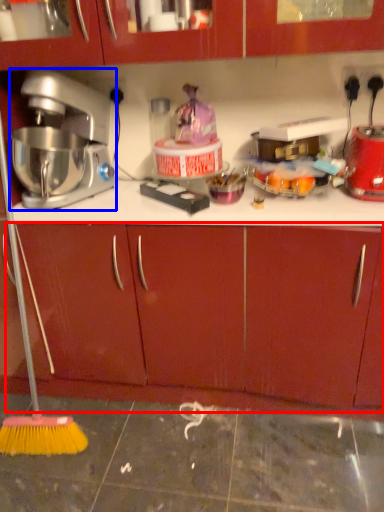
Question: Which object is closer to the camera taking this photo, drawer (highlighted by a red box) or mixer (highlighted by a blue box)?

Choices:
 (A) drawer
 (B) mixer

Answer: (B)